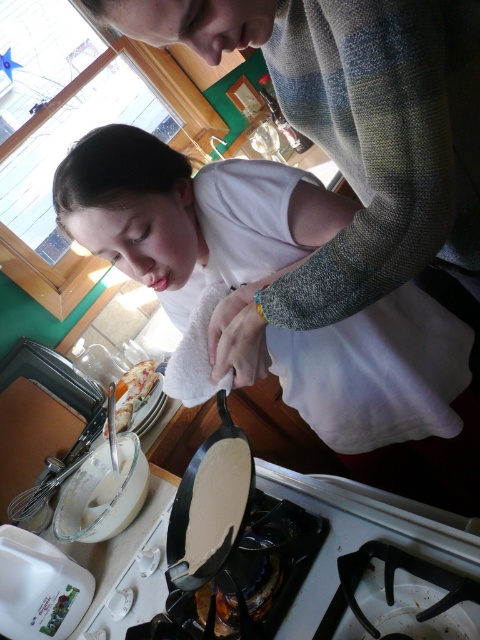
Between matte white towel at center and golden crispy bread at center, which one appears on the left side from the viewer's perspective?

golden crispy bread at center is more to the left.

Between point (423, 468) and point (155, 365), which one is positioned behind?

Positioned behind is point (155, 365).

Who is more distant from viewer, (377, 337) or (129, 380)?

The point (129, 380) is more distant.

Image resolution: width=480 pixels, height=640 pixels. Find the location of `matte white towel at center`. matte white towel at center is located at coordinates (191, 218).

How distant is matte white towel at center from white glossy gas stove at lower center?

matte white towel at center is 12.92 inches from white glossy gas stove at lower center.

Does matte white towel at center appear on the right side of white glossy gas stove at lower center?

Indeed, matte white towel at center is positioned on the right side of white glossy gas stove at lower center.

Between point (146, 256) and point (93, 621), which one is positioned behind?

Positioned behind is point (93, 621).

Locate an element on the screen. The height and width of the screenshot is (640, 480). matte white towel at center is located at coordinates pos(191,218).

Does black cast iron frying pan at center appear under golden crispy bread at center?

Yes.

Between black cast iron frying pan at center and golden crispy bread at center, which one is positioned lower?

black cast iron frying pan at center

Is point (175, 522) less distant than point (120, 380)?

Yes, point (175, 522) is in front of point (120, 380).

Where is `black cast iron frying pan at center`? Image resolution: width=480 pixels, height=640 pixels. black cast iron frying pan at center is located at coordinates (210, 504).